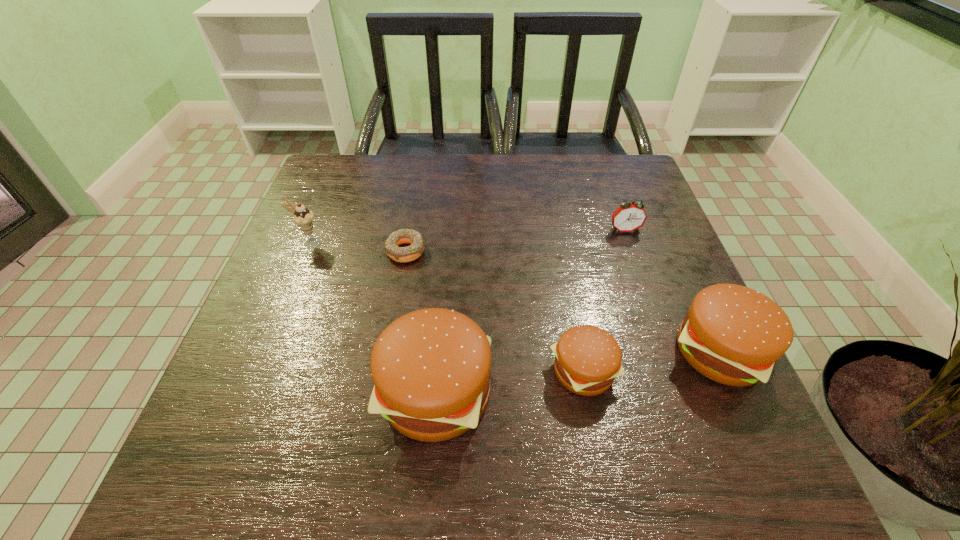
I want to click on unoccupied position between the doughnut and the rightmost hamburger, so click(563, 301).

This screenshot has width=960, height=540. What are the coordinates of `vacant area that lies between the alarm clock and the second shortest object` in the screenshot? It's located at (604, 301).

Locate an element on the screen. empty space that is in between the rightmost hamburger and the icecream is located at coordinates (515, 298).

The height and width of the screenshot is (540, 960). I want to click on object that stands as the fifth closest to the leftmost hamburger, so click(629, 217).

You are a GUI agent. You are given a task and a screenshot of the screen. Output one action in this format:
    pyautogui.click(x=<x>, y=<y>)
    Task: Click on the object that is the third closest to the alarm clock
    Image resolution: width=960 pixels, height=540 pixels.
    Given the screenshot: What is the action you would take?
    pyautogui.click(x=431, y=368)

The height and width of the screenshot is (540, 960). What are the coordinates of `hamburger that stands as the closest to the leftmost object` in the screenshot? It's located at (431, 368).

Select which hamburger is the third closest to the doughnut. Please provide its 2D coordinates. Your answer should be formatted as a tuple, i.e. [(x, y)], where the tuple contains the x and y coordinates of a point satisfying the conditions above.

[(734, 335)]

This screenshot has width=960, height=540. Find the location of `blank space that satisfies the following two spatial constraints: 1. on the front side of the third object from right to left; 2. on the right side of the doughnut`. blank space that satisfies the following two spatial constraints: 1. on the front side of the third object from right to left; 2. on the right side of the doughnut is located at coordinates (385, 372).

In order to click on free space that satisfies the following two spatial constraints: 1. on the clock face of the alarm clock; 2. on the left side of the rightmost hamburger in this screenshot , I will do (x=667, y=352).

At what (x,y) coordinates should I click in order to perform the action: click on vacant space that satisfies the following two spatial constraints: 1. on the back side of the third object from right to left; 2. on the right side of the leftmost hamburger. Please return your answer as a coordinate pair (x, y). Looking at the image, I should click on (438, 372).